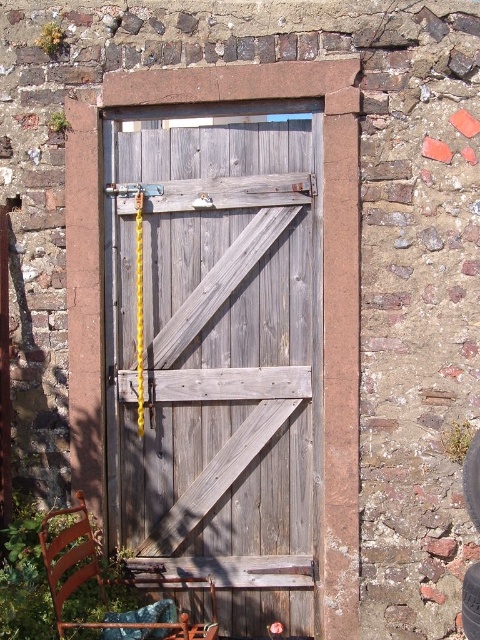
Question: Can you confirm if black rubber tire at lower right is wider than black rubber tire at center?

Choices:
 (A) yes
 (B) no

Answer: (B)

Question: Which point is farther to the camera?

Choices:
 (A) weathered wood door at center
 (B) wooden chair at lower left
 (C) black rubber tire at center

Answer: (A)

Question: Can you confirm if black rubber tire at lower right is positioned to the right of black rubber tire at center?

Choices:
 (A) yes
 (B) no

Answer: (A)

Question: Which point appears closest to the camera in this image?

Choices:
 (A) [x=463, y=628]
 (B) [x=250, y=584]
 (C) [x=78, y=500]

Answer: (A)

Question: Which of these objects is positioned farthest from the weathered wood door at center?

Choices:
 (A) black rubber tire at center
 (B) wooden chair at lower left
 (C) black rubber tire at lower right

Answer: (A)

Question: Does weathered wood door at center appear on the left side of wooden chair at lower left?

Choices:
 (A) yes
 (B) no

Answer: (B)